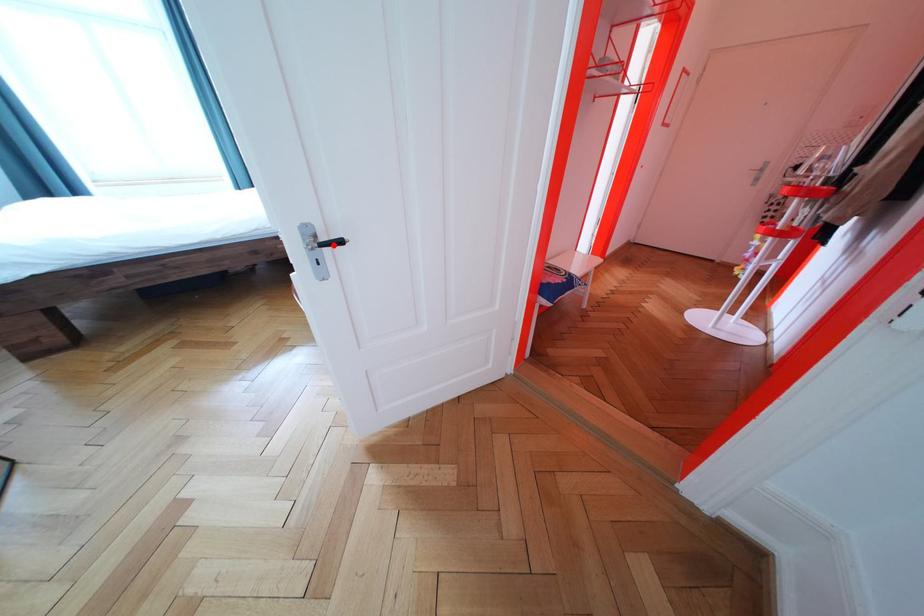
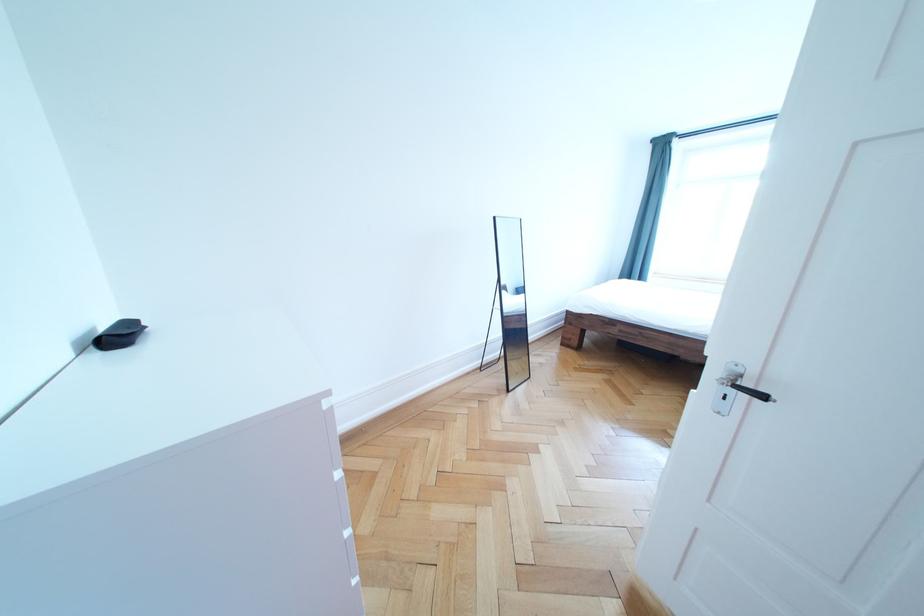
Find the pixel in the second image that matches the highlighted location in the first image.

(757, 389)